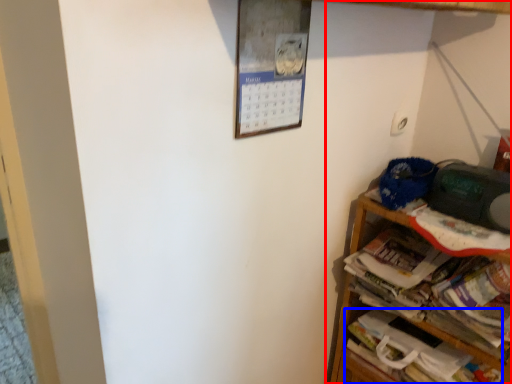
Question: Which of the following is the closest to the observer, shelf (highlighted by a red box) or book (highlighted by a blue box)?

Choices:
 (A) shelf
 (B) book

Answer: (A)